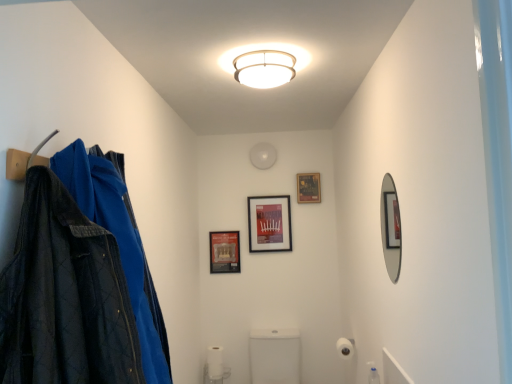
Question: Does matte black picture frame at center, placed as the second picture frame when sorted from left to right, have a greater height compared to matte black picture frame at upper center, acting as the 1th picture frame starting from the right?

Choices:
 (A) no
 (B) yes

Answer: (B)

Question: Considering the relative positions of matte black picture frame at center, the 2th picture frame positioned from the right, and matte black picture frame at upper center, placed as the 3th picture frame when sorted from left to right, in the image provided, is matte black picture frame at center, the 2th picture frame positioned from the right, in front of matte black picture frame at upper center, placed as the 3th picture frame when sorted from left to right,?

Choices:
 (A) yes
 (B) no

Answer: (A)

Question: Is matte black picture frame at upper center, acting as the 1th picture frame starting from the right, completely or partially inside matte black picture frame at center, the 2th picture frame positioned from the right?

Choices:
 (A) no
 (B) yes

Answer: (A)

Question: From the image's perspective, is matte black picture frame at center, the 2th picture frame positioned from the right, under matte black picture frame at upper center, acting as the 1th picture frame starting from the right?

Choices:
 (A) yes
 (B) no

Answer: (A)

Question: Would you say matte black picture frame at center, placed as the second picture frame when sorted from left to right, is a long distance from matte black picture frame at upper center, acting as the 1th picture frame starting from the right?

Choices:
 (A) yes
 (B) no

Answer: (B)

Question: Can you confirm if matte black picture frame at center, placed as the second picture frame when sorted from left to right, is smaller than matte black picture frame at upper center, acting as the 1th picture frame starting from the right?

Choices:
 (A) no
 (B) yes

Answer: (A)

Question: Is matte black picture frame at center, the 3th picture frame when ordered from right to left, further to the viewer compared to silver-framed mirror at right?

Choices:
 (A) no
 (B) yes

Answer: (B)

Question: From a real-world perspective, is matte black picture frame at center, the 3th picture frame when ordered from right to left, below silver-framed mirror at right?

Choices:
 (A) yes
 (B) no

Answer: (A)

Question: Considering the relative sizes of matte black picture frame at center, the 3th picture frame when ordered from right to left, and silver-framed mirror at right in the image provided, is matte black picture frame at center, the 3th picture frame when ordered from right to left, shorter than silver-framed mirror at right?

Choices:
 (A) yes
 (B) no

Answer: (A)

Question: Can you confirm if matte black picture frame at center, the 3th picture frame when ordered from right to left, is taller than silver-framed mirror at right?

Choices:
 (A) yes
 (B) no

Answer: (B)

Question: Is matte black picture frame at center, the 3th picture frame when ordered from right to left, closer to camera compared to silver-framed mirror at right?

Choices:
 (A) no
 (B) yes

Answer: (A)

Question: Is there a large distance between matte black picture frame at center, the 3th picture frame when ordered from right to left, and silver-framed mirror at right?

Choices:
 (A) yes
 (B) no

Answer: (A)

Question: Is matte black picture frame at center, placed as the second picture frame when sorted from left to right, wider than white matte toilet paper at lower center, the 2th toilet paper from the top?

Choices:
 (A) yes
 (B) no

Answer: (B)